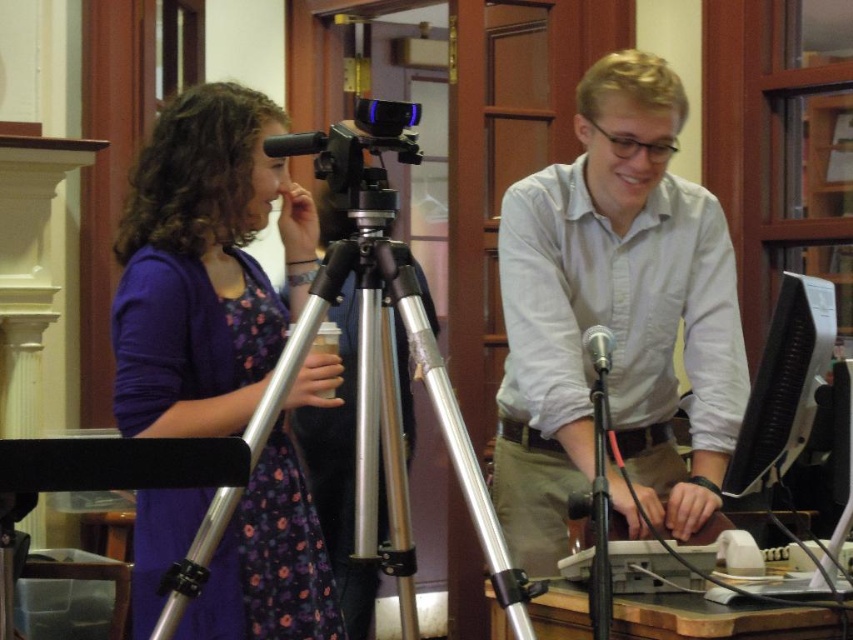
You are organizing a photoshoot and need to ensure that the white cotton shirt at center and the purple fabric dress at left are both visible in the frame. Based on their positions, which clothing item is covering part of the other?

The white cotton shirt at center is positioned over the purple fabric dress at left, so it is covering part of it.

You are a photographer trying to set up a tripod between the white cotton shirt at center and the black glossy monitor at right. The tripod requires at least 15 inches of space between the two objects to fit. Based on the scene, will the tripod fit?

The distance between the white cotton shirt at center and the black glossy monitor at right is 14.53 inches, which is less than the required 15 inches. Therefore, the tripod will not fit between them.